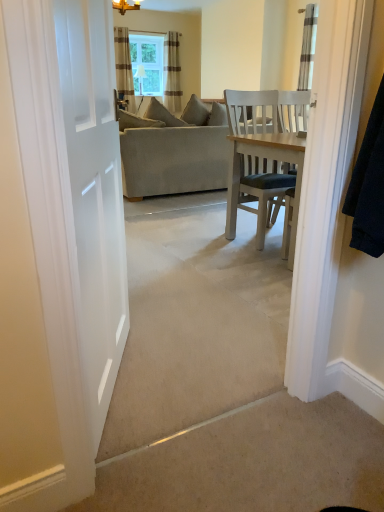
Question: Does beige fabric couch at center come in front of striped fabric curtain at upper center, which is counted as the 2th curtain, starting from the right?

Choices:
 (A) no
 (B) yes

Answer: (B)

Question: From a real-world perspective, is beige fabric couch at center under striped fabric curtain at upper center, which is the 3th curtain in front-to-back order?

Choices:
 (A) yes
 (B) no

Answer: (A)

Question: Can we say beige fabric couch at center lies outside striped fabric curtain at upper center, which is counted as the 2th curtain, starting from the right?

Choices:
 (A) yes
 (B) no

Answer: (A)

Question: Is beige fabric couch at center at the right side of striped fabric curtain at upper center, acting as the first curtain starting from the back?

Choices:
 (A) no
 (B) yes

Answer: (B)

Question: From a real-world perspective, is beige fabric couch at center on striped fabric curtain at upper center, which is the 3th curtain in front-to-back order?

Choices:
 (A) yes
 (B) no

Answer: (B)

Question: Looking at their shapes, would you say striped fabric curtain at upper center, which is the 3th curtain in right-to-left order, is wider or thinner than striped fabric curtain at upper right, which is counted as the first curtain, starting from the front?

Choices:
 (A) wide
 (B) thin

Answer: (A)

Question: From their relative heights in the image, would you say striped fabric curtain at upper center, which is the 3th curtain in right-to-left order, is taller or shorter than striped fabric curtain at upper right, positioned as the third curtain in left-to-right order?

Choices:
 (A) short
 (B) tall

Answer: (B)

Question: From the image's perspective, is striped fabric curtain at upper center, which is the 2th curtain in front-to-back order, above or below striped fabric curtain at upper right, which ranks as the first curtain in right-to-left order?

Choices:
 (A) above
 (B) below

Answer: (A)

Question: Does point (117, 61) appear closer or farther from the camera than point (309, 37)?

Choices:
 (A) farther
 (B) closer

Answer: (A)

Question: Based on their sizes in the image, would you say striped fabric curtain at upper center, which is counted as the 2th curtain, starting from the right, is bigger or smaller than beige fabric couch at center?

Choices:
 (A) small
 (B) big

Answer: (A)

Question: Is point (178, 95) positioned closer to the camera than point (195, 151)?

Choices:
 (A) closer
 (B) farther

Answer: (B)

Question: From the image's perspective, relative to beige fabric couch at center, is striped fabric curtain at upper center, which appears as the second curtain when viewed from the left, above or below?

Choices:
 (A) above
 (B) below

Answer: (A)

Question: Is striped fabric curtain at upper center, which is counted as the 2th curtain, starting from the right, inside or outside of beige fabric couch at center?

Choices:
 (A) outside
 (B) inside

Answer: (A)

Question: In the image, is clear glass window at upper center on the left side or the right side of beige fabric couch at center?

Choices:
 (A) left
 (B) right

Answer: (A)

Question: Is clear glass window at upper center taller or shorter than beige fabric couch at center?

Choices:
 (A) short
 (B) tall

Answer: (A)